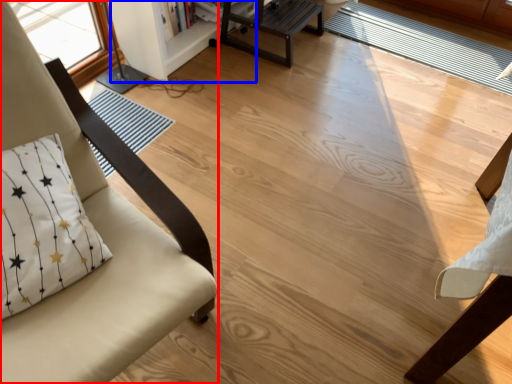
Question: Which of the following is the closest to the observer, chair (highlighted by a red box) or bookshelf (highlighted by a blue box)?

Choices:
 (A) chair
 (B) bookshelf

Answer: (A)